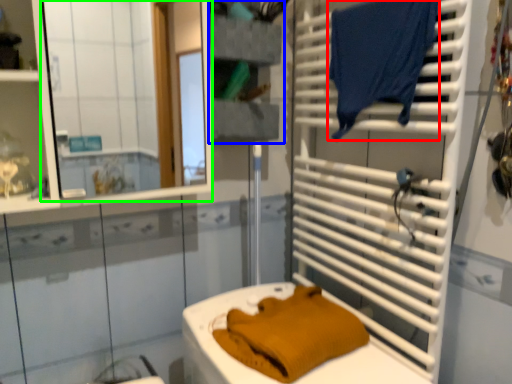
Question: Considering the real-world distances, which object is farthest from laundry (highlighted by a red box)? shelf (highlighted by a blue box) or mirror (highlighted by a green box)?

Choices:
 (A) shelf
 (B) mirror

Answer: (B)